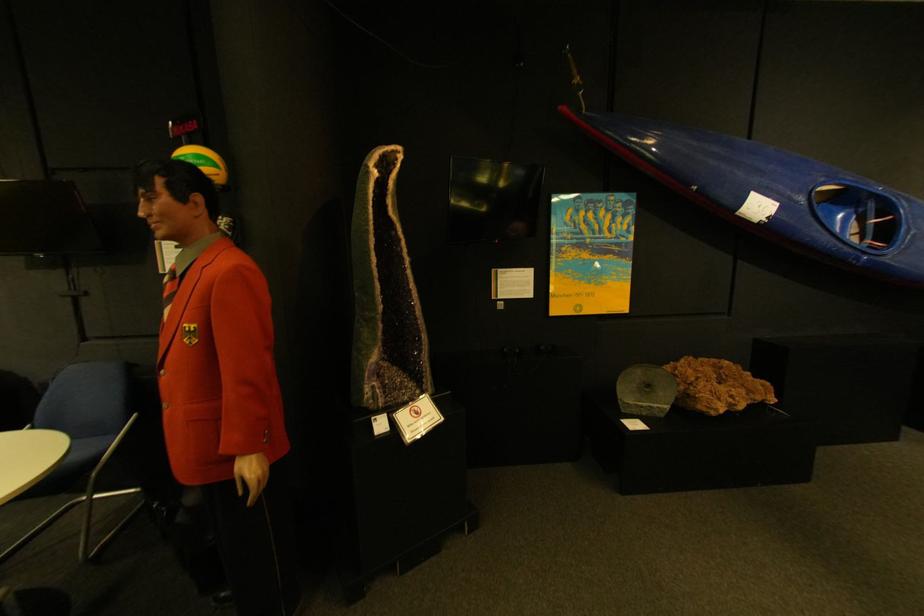
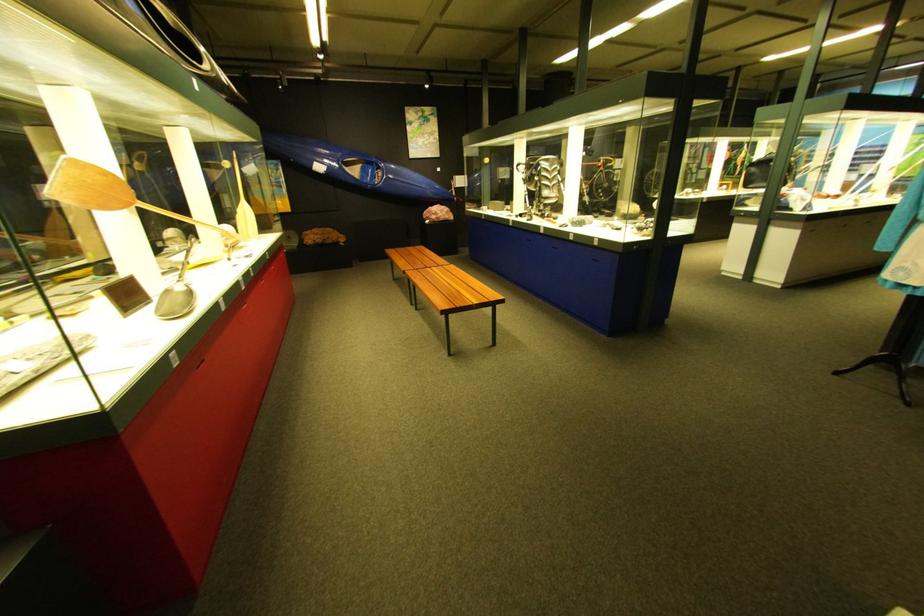
In the second image, find the point that corresponds to point (794, 207) in the first image.

(342, 169)